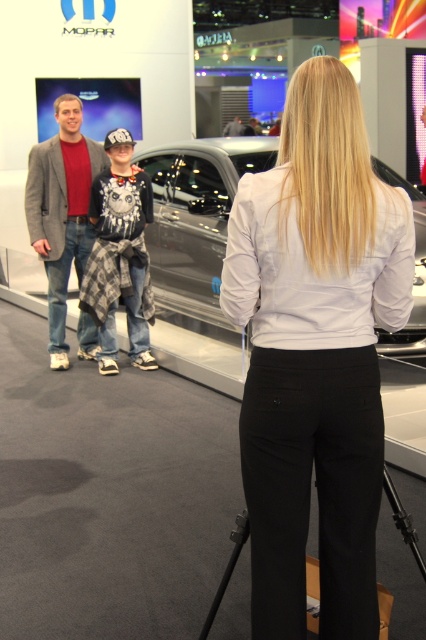
You are a photographer at the Mopar exhibition and need to capture a photo of both the white smooth shirt at center and the dark gray suit at center. Based on their positions, which one is wider?

The white smooth shirt at center is wider than the dark gray suit at center.

You are a photographer at the Mopar exhibition. You want to take a photo of the gray wool blazer at left and the dark gray suit at center. How far apart are these two items in meters?

The gray wool blazer at left is 8.05 meters from the dark gray suit at center.

You are a fashion designer analyzing the clothing items in the scene. Which clothing item is narrower between the white smooth shirt at center and the gray wool blazer at left?

The white smooth shirt at center is narrower than the gray wool blazer at left, as its width is less than the blazer.